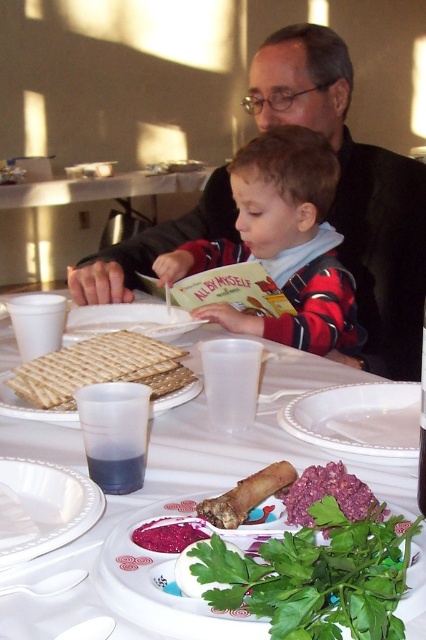
Is red plaid sweater at center further to camera compared to purple crumbly spread at center?

Yes.

Is red plaid sweater at center shorter than purple crumbly spread at center?

No, red plaid sweater at center is not shorter than purple crumbly spread at center.

What do you see at coordinates (282, 243) in the screenshot?
I see `red plaid sweater at center` at bounding box center [282, 243].

Find the location of a particular element. red plaid sweater at center is located at coordinates (282, 243).

Which of these two, white paper plate at center or white ceramic plate at lower left, stands taller?

white paper plate at center is taller.

What do you see at coordinates (176, 496) in the screenshot? This screenshot has height=640, width=426. I see `white paper plate at center` at bounding box center [176, 496].

Where is `white paper plate at center`? This screenshot has width=426, height=640. white paper plate at center is located at coordinates (176, 496).

Measure the distance between point (31,515) and camera.

Point (31,515) and camera are 43.62 centimeters apart.

Who is positioned more to the right, white ceramic plate at lower left or purple crumbly spread at center?

purple crumbly spread at center is more to the right.

Is point (72, 500) more distant than point (316, 483)?

Yes, point (72, 500) is farther from viewer.

The width and height of the screenshot is (426, 640). I want to click on white ceramic plate at lower left, so (x=43, y=508).